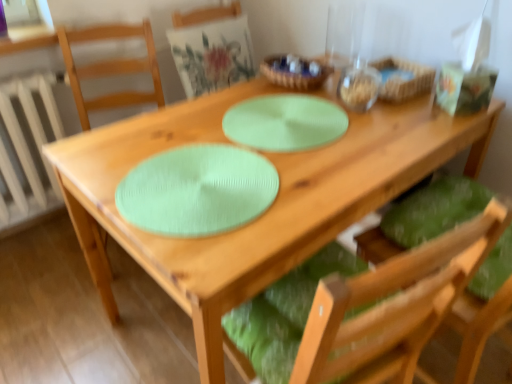
Find the location of a particular element. vacant area that is in front of wooden bowl at upper center is located at coordinates (294, 103).